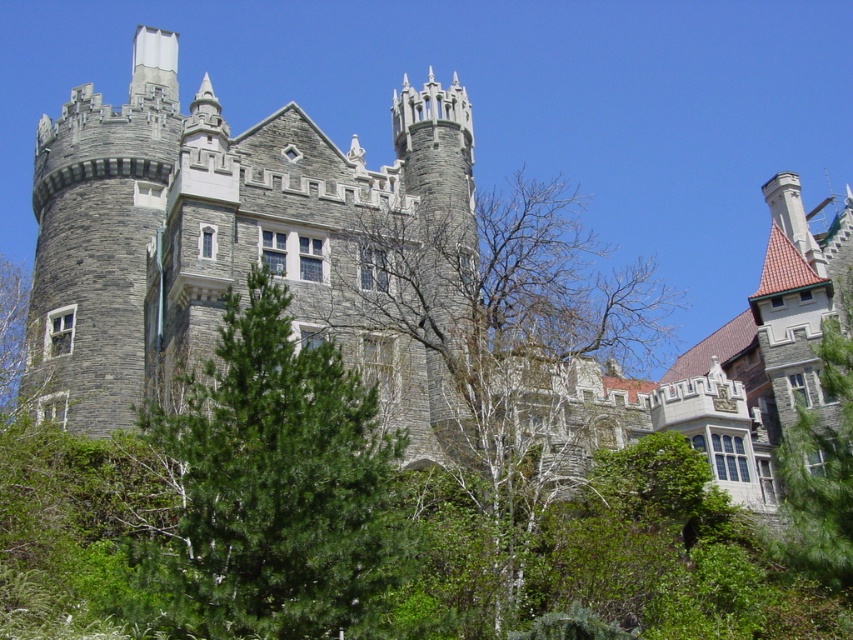
Question: Which object is the farthest from the green needle-like tree at center?

Choices:
 (A) bare branches at center
 (B) green leafy tree at right
 (C) gray stone tower at center

Answer: (B)

Question: Can you confirm if gray stone tower at center is positioned above green needle-like tree at center?

Choices:
 (A) yes
 (B) no

Answer: (A)

Question: Does bare branches at center appear over green leafy tree at right?

Choices:
 (A) no
 (B) yes

Answer: (B)

Question: Based on their relative distances, which object is farther from the green needle-like tree at center?

Choices:
 (A) green leafy tree at right
 (B) gray stone tower at center
 (C) bare branches at center

Answer: (A)

Question: Which object is farther from the camera taking this photo?

Choices:
 (A) gray stone tower at center
 (B) green needle-like tree at center

Answer: (A)

Question: Does green needle-like tree at center have a smaller size compared to green leafy tree at right?

Choices:
 (A) yes
 (B) no

Answer: (A)